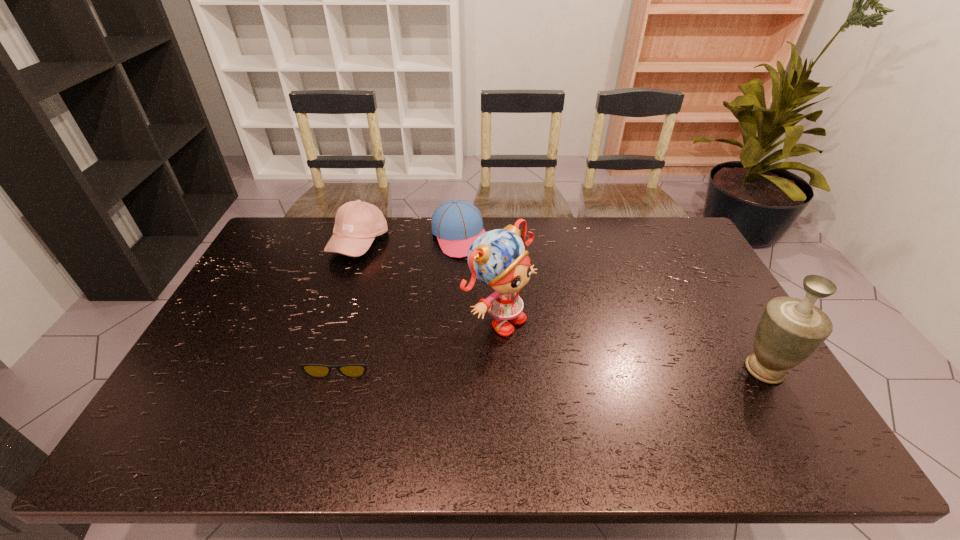
Locate an element on the screen. This screenshot has height=540, width=960. free point located 0.340m on the face of the doll is located at coordinates (644, 410).

Image resolution: width=960 pixels, height=540 pixels. Identify the location of vacant region located 0.180m on the front-facing side of the second shortest object. (491, 292).

In order to click on vacant space positioned on the front-facing side of the second shortest object in this screenshot , I will do `click(476, 267)`.

Where is `blank area located on the front-facing side of the second shortest object`? Image resolution: width=960 pixels, height=540 pixels. blank area located on the front-facing side of the second shortest object is located at coordinates (498, 305).

Find the location of `free space located on the front-facing side of the left baseball cap`. free space located on the front-facing side of the left baseball cap is located at coordinates (445, 327).

Where is `free space located on the front-facing side of the left baseball cap`? Image resolution: width=960 pixels, height=540 pixels. free space located on the front-facing side of the left baseball cap is located at coordinates (405, 291).

The width and height of the screenshot is (960, 540). I want to click on free space located on the front-facing side of the left baseball cap, so click(441, 323).

The height and width of the screenshot is (540, 960). In order to click on object that is at the near edge in this screenshot , I will do `click(790, 330)`.

The width and height of the screenshot is (960, 540). I want to click on object located in the right edge section of the desktop, so (x=790, y=330).

You are a GUI agent. You are given a task and a screenshot of the screen. Output one action in this format:
    pyautogui.click(x=<x>, y=<y>)
    Task: Click on the object located at the near right corner
    Image resolution: width=960 pixels, height=540 pixels.
    Given the screenshot: What is the action you would take?
    pyautogui.click(x=790, y=330)